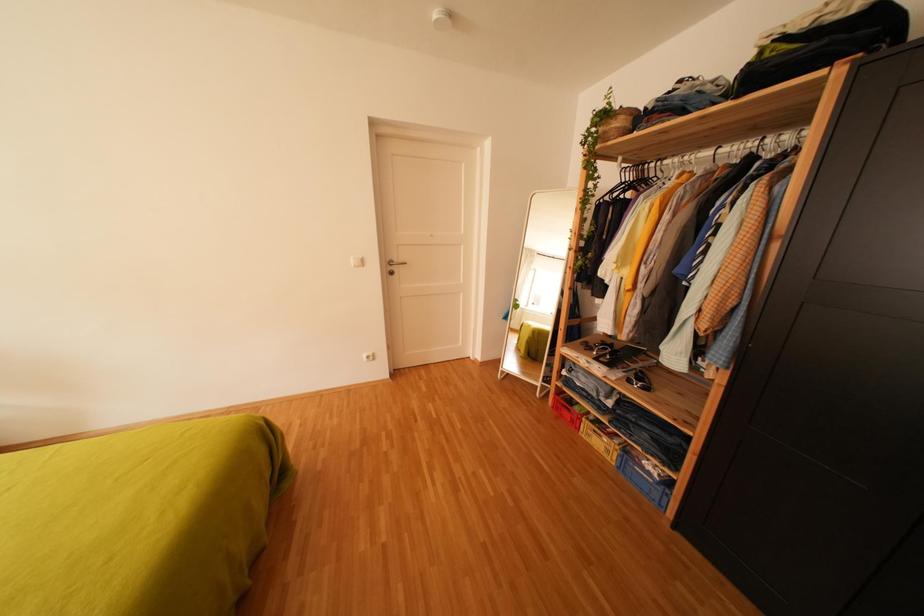
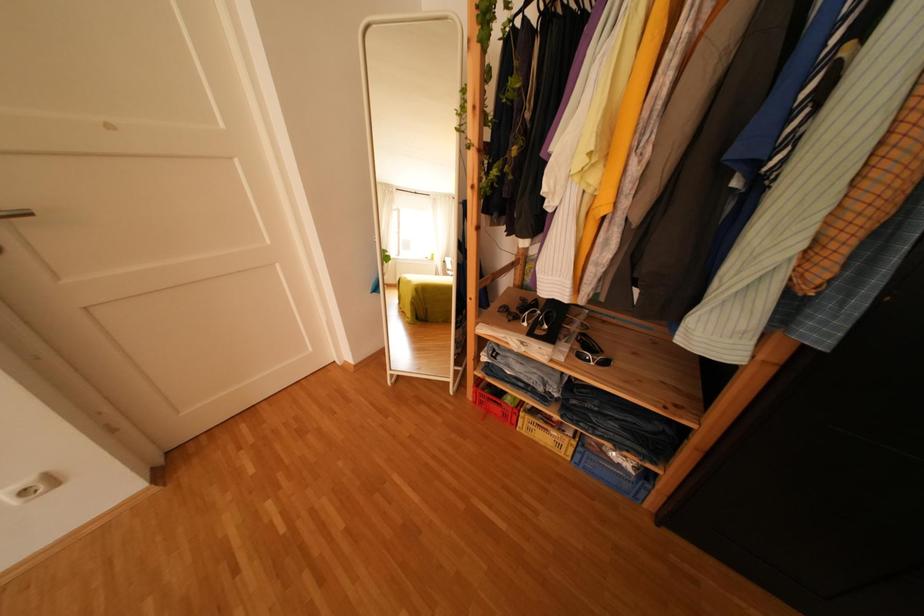
Question: The camera is either moving clockwise (left) or counter-clockwise (right) around the object. The first image is from the beginning of the video and the second image is from the end. Is the camera moving left or right when shooting the video?

Choices:
 (A) Left
 (B) Right

Answer: (A)